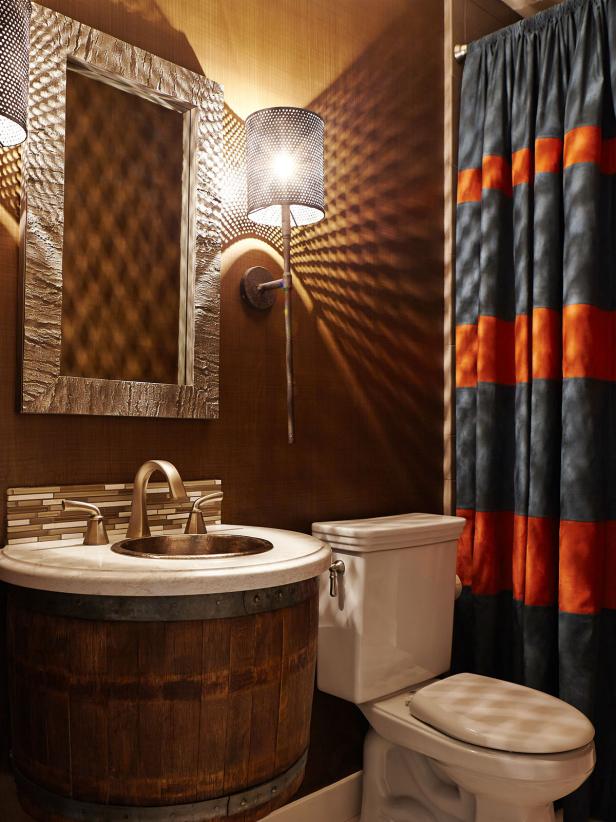
Locate an element on the screen. wall is located at coordinates (288, 47).